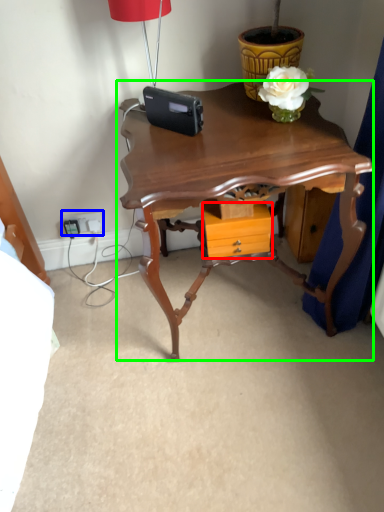
Question: Which object is positioned farthest from drawer (highlighted by a red box)? Select from electric outlet (highlighted by a blue box) and table (highlighted by a green box).

Choices:
 (A) electric outlet
 (B) table

Answer: (A)